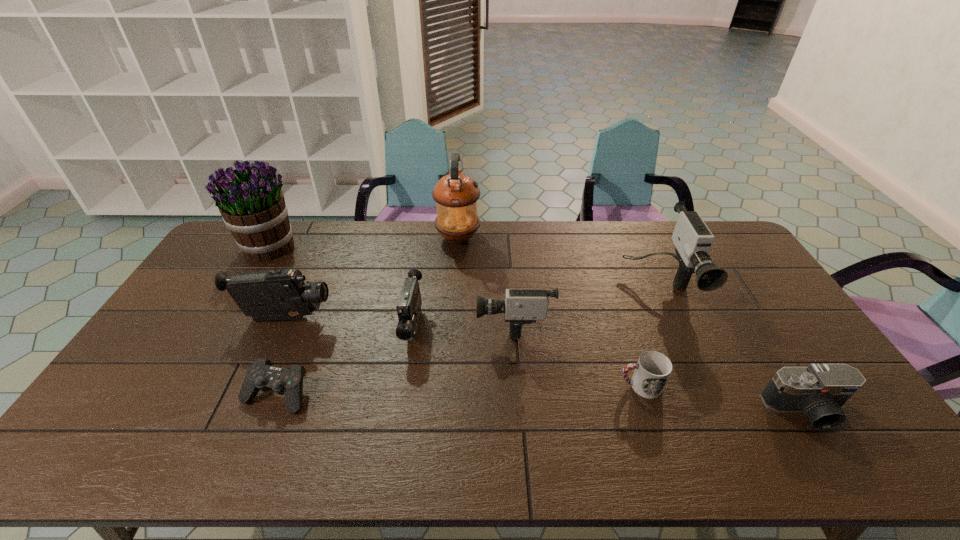
In order to click on oil lamp in this screenshot , I will do `click(456, 195)`.

You are a GUI agent. You are given a task and a screenshot of the screen. Output one action in this format:
    pyautogui.click(x=<x>, y=<y>)
    Task: Click on the bouquet
    
    Given the screenshot: What is the action you would take?
    pyautogui.click(x=252, y=205)

You are a GUI agent. You are given a task and a screenshot of the screen. Output one action in this format:
    pyautogui.click(x=<x>, y=<y>)
    Task: Click on the right white camcorder
    The image size is (960, 540).
    Given the screenshot: What is the action you would take?
    pyautogui.click(x=693, y=240)

The width and height of the screenshot is (960, 540). What are the coordinates of `the bigger white camcorder` in the screenshot? It's located at (693, 240).

Where is `the leftmost camcorder`? the leftmost camcorder is located at coordinates (282, 294).

Locate an element on the screen. This screenshot has height=540, width=960. the bigger black camcorder is located at coordinates (282, 294).

Find the location of a particular element. The image size is (960, 540). the smaller white camcorder is located at coordinates (521, 306).

This screenshot has width=960, height=540. I want to click on the left white camcorder, so coord(521,306).

This screenshot has height=540, width=960. Identify the location of the shortest camcorder. (408, 307).

Locate an element on the screen. The height and width of the screenshot is (540, 960). the smaller black camcorder is located at coordinates (408, 307).